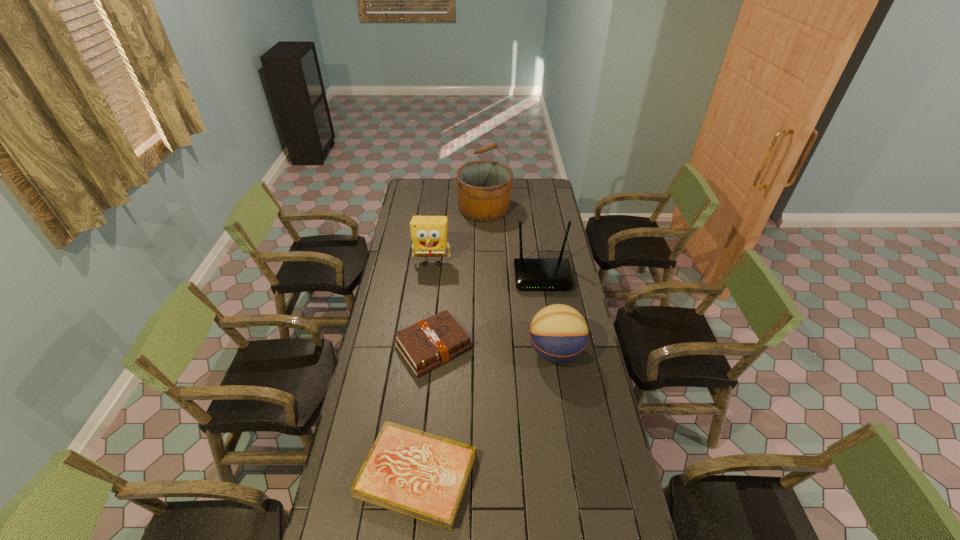
The height and width of the screenshot is (540, 960). I want to click on blank space located 0.300m on the front-facing side of the router, so click(x=552, y=342).

In order to click on vacant space located 0.300m on the face of the sponge in this screenshot , I will do `click(425, 316)`.

Where is `vacant region located on the patterned surface of the basketball`? Image resolution: width=960 pixels, height=540 pixels. vacant region located on the patterned surface of the basketball is located at coordinates (505, 352).

I want to click on blank space located 0.150m on the patterned surface of the basketball, so click(491, 352).

This screenshot has height=540, width=960. I want to click on vacant space located 0.230m on the patterned surface of the basketball, so click(x=471, y=352).

Locate an element on the screen. The height and width of the screenshot is (540, 960). vacant space located on the front of the second shortest object is located at coordinates (421, 468).

The height and width of the screenshot is (540, 960). What are the coordinates of `free space located 0.100m on the back of the nearest object` in the screenshot? It's located at (424, 403).

At what (x,y) coordinates should I click in order to perform the action: click on object located at the far edge. Please return your answer as a coordinate pair (x, y). The height and width of the screenshot is (540, 960). Looking at the image, I should click on (484, 187).

The image size is (960, 540). Find the location of `sponge located in the left edge section of the desktop`. sponge located in the left edge section of the desktop is located at coordinates (428, 233).

At what (x,y) coordinates should I click in order to perform the action: click on router that is positioned at the right edge. Please return your answer as a coordinate pair (x, y). The image size is (960, 540). Looking at the image, I should click on (530, 273).